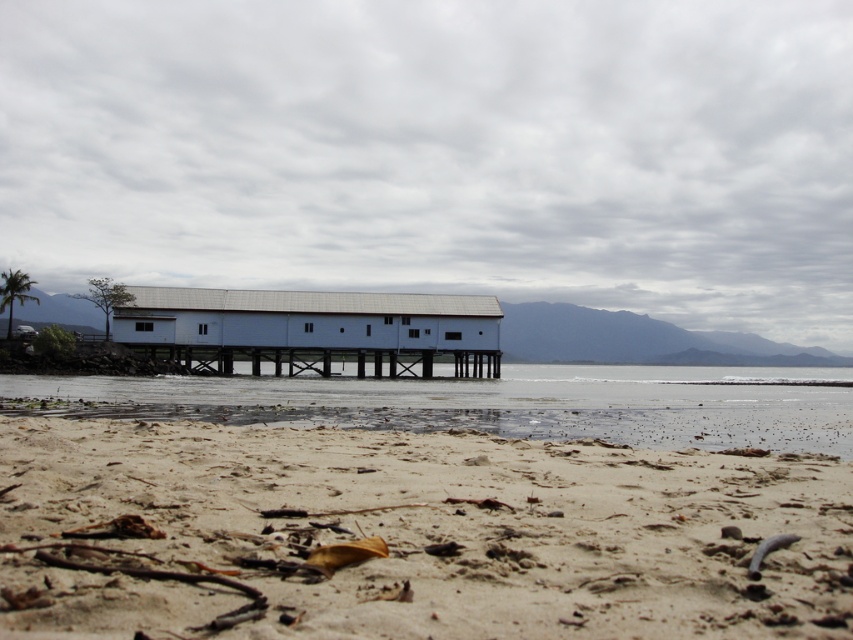
Question: Can you confirm if clear water at lower center is positioned to the right of white matte wooden hut at center?

Choices:
 (A) yes
 (B) no

Answer: (A)

Question: Is white matte wooden hut at center wider than white painted wood dock at center?

Choices:
 (A) yes
 (B) no

Answer: (A)

Question: Can you confirm if white matte wooden hut at center is positioned to the left of white painted wood dock at center?

Choices:
 (A) no
 (B) yes

Answer: (B)

Question: Which of the following is the farthest from the observer?

Choices:
 (A) (387, 320)
 (B) (403, 396)
 (C) (216, 531)

Answer: (A)

Question: Which point appears farthest from the camera in this image?

Choices:
 (A) (531, 429)
 (B) (498, 337)

Answer: (B)

Question: Which point is farther to the camera?

Choices:
 (A) (457, 321)
 (B) (595, 408)

Answer: (A)